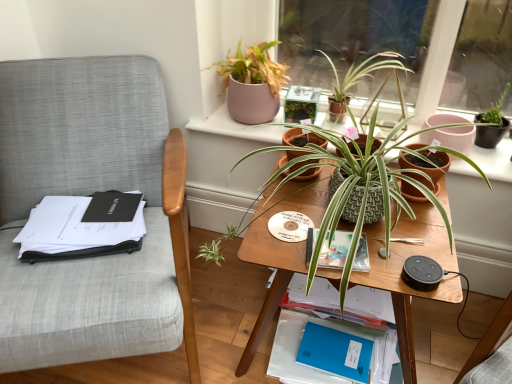
This screenshot has width=512, height=384. Find the location of `free region on the left part of hardcover book at center, the 1th paperback book positioned from the top`. free region on the left part of hardcover book at center, the 1th paperback book positioned from the top is located at coordinates (281, 235).